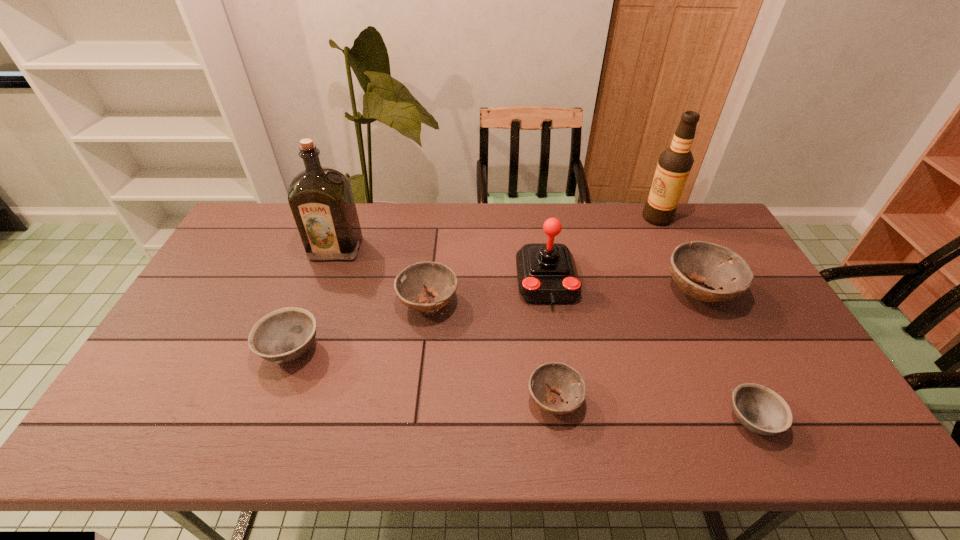
Image resolution: width=960 pixels, height=540 pixels. In order to click on the smallest brown bowl in this screenshot , I will do `click(566, 381)`.

Image resolution: width=960 pixels, height=540 pixels. What are the coordinates of `the third bowl from left to right` in the screenshot? It's located at (566, 381).

Where is `the nearer gray bowl`? the nearer gray bowl is located at coordinates (761, 410).

You are a GUI agent. You are given a task and a screenshot of the screen. Output one action in this format:
    pyautogui.click(x=<x>, y=<y>)
    Task: Click on the smaller gray bowl
    The width and height of the screenshot is (960, 540).
    Given the screenshot: What is the action you would take?
    pyautogui.click(x=761, y=410)

The image size is (960, 540). I want to click on free space located on the label of the beige alcohol, so click(x=601, y=218).

What are the coordinates of `free point located 0.120m on the label of the beige alcohol` in the screenshot? It's located at (609, 218).

I want to click on vacant point located on the label of the beige alcohol, so click(557, 218).

The width and height of the screenshot is (960, 540). I want to click on free space located 0.400m on the label of the liquor, so click(x=295, y=366).

I want to click on free point located 0.080m on the base of the third tallest object, so click(555, 335).

Find the location of a particular element. Image resolution: width=960 pixels, height=540 pixels. vacant space situated on the back of the tallest bowl is located at coordinates (657, 205).